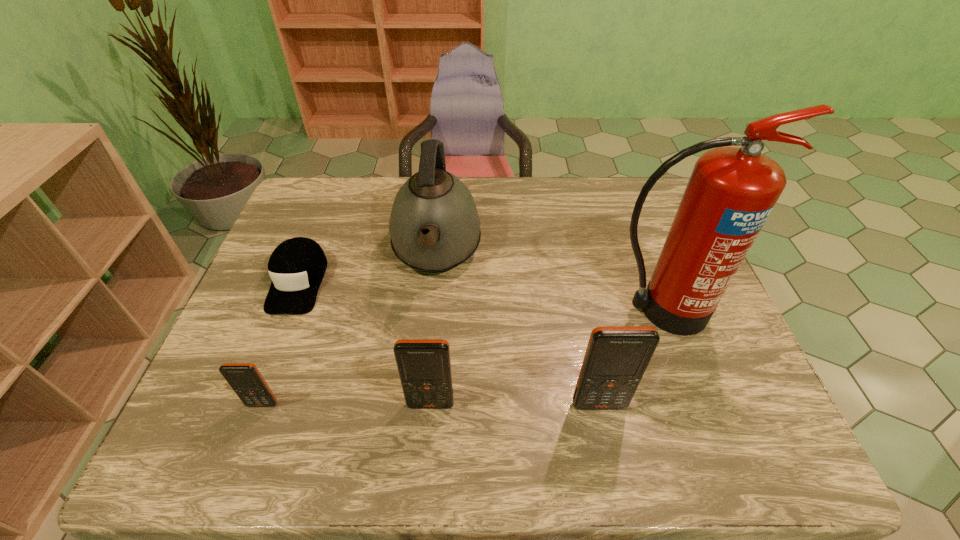
Locate an element on the screen. Image resolution: width=960 pixels, height=540 pixels. vacant place for an extra cellular telephone on the right is located at coordinates (768, 405).